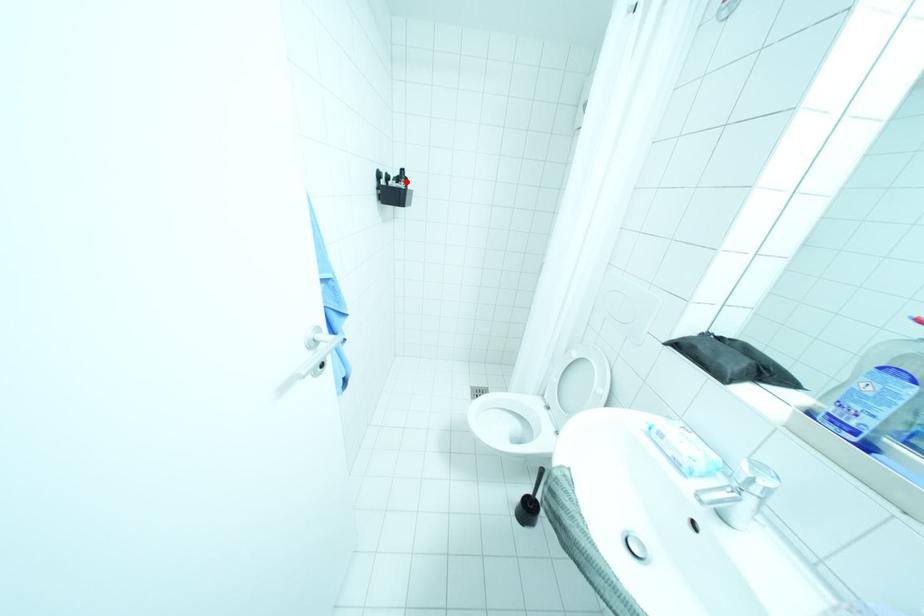
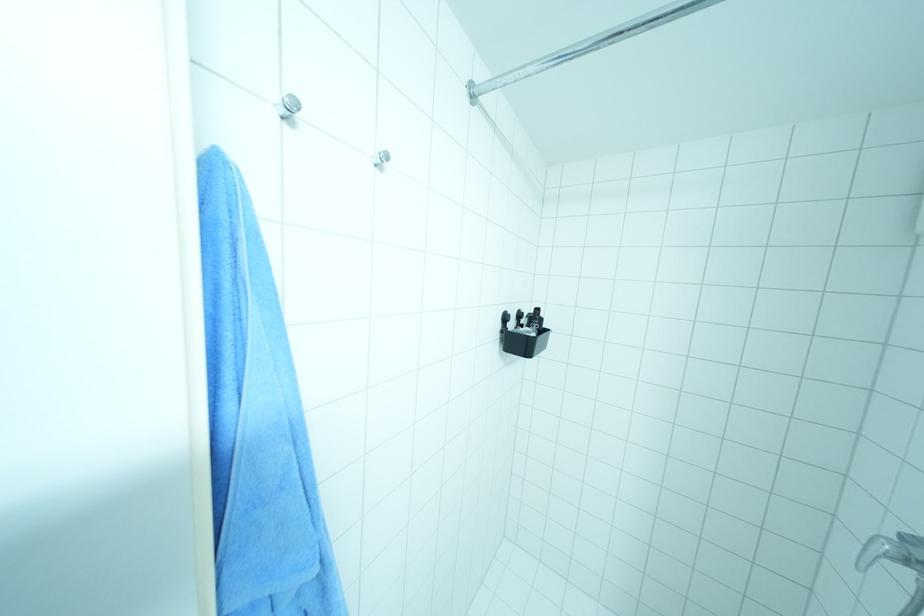
Question: I am providing you with two images of the same scene from different viewpoints. A red point is marked on the first image. Can you still see the location of the red point in image 2?

Choices:
 (A) Yes
 (B) No

Answer: (A)